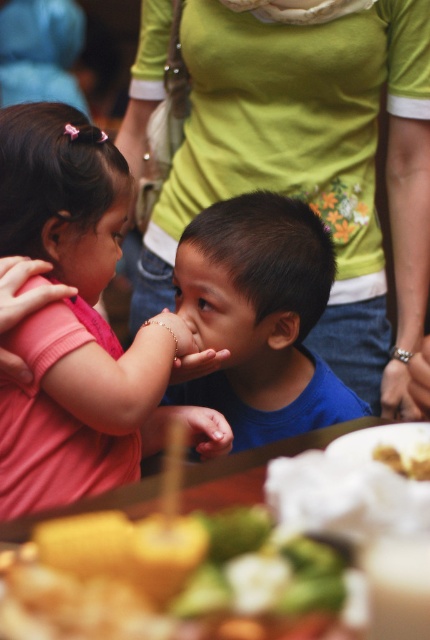
Question: Which object is positioned farthest from the green fabric shirt at center?

Choices:
 (A) blue matte shirt at center
 (B) yellow crumbly bread at lower right
 (C) smooth yellow bread at lower left
 (D) pink matte shirt at left

Answer: (C)

Question: Observing the image, what is the correct spatial positioning of smooth yellow bread at lower left in reference to yellow crumbly bread at lower right?

Choices:
 (A) right
 (B) left

Answer: (B)

Question: Based on their relative distances, which object is farther from the yellow crumbly bread at lower right?

Choices:
 (A) green fabric shirt at center
 (B) pink matte shirt at left
 (C) blue matte shirt at center

Answer: (A)

Question: Which is farther from the smooth yellow bread at lower left?

Choices:
 (A) green fabric shirt at center
 (B) blue matte shirt at center
 (C) yellow crumbly bread at lower right

Answer: (A)

Question: Can you confirm if green fabric shirt at center is thinner than blue matte shirt at center?

Choices:
 (A) no
 (B) yes

Answer: (A)

Question: Does green fabric shirt at center have a smaller size compared to pink matte shirt at left?

Choices:
 (A) no
 (B) yes

Answer: (A)